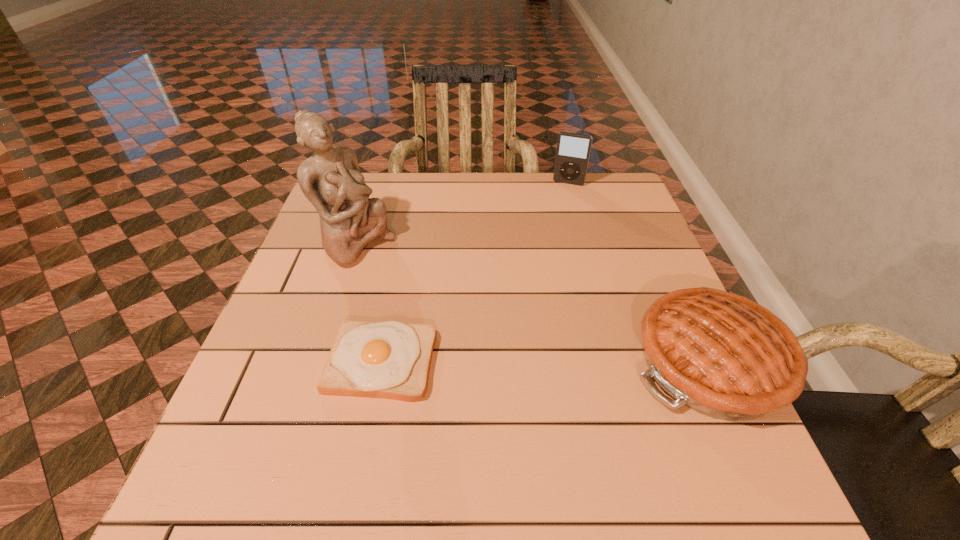
The width and height of the screenshot is (960, 540). Find the location of `free space between the tallest object and the second shortest object`. free space between the tallest object and the second shortest object is located at coordinates pyautogui.click(x=534, y=303).

Locate which object is the third closest to the toast. Please provide its 2D coordinates. Your answer should be formatted as a tuple, i.e. [(x, y)], where the tuple contains the x and y coordinates of a point satisfying the conditions above.

[(573, 150)]

Identify which object is the third nearest to the farthest object. Please provide its 2D coordinates. Your answer should be formatted as a tuple, i.e. [(x, y)], where the tuple contains the x and y coordinates of a point satisfying the conditions above.

[(391, 359)]

Identify the location of blank area in the image that satisfies the following two spatial constraints: 1. on the front side of the pie; 2. on the left side of the third shortest object. (618, 362).

Find the location of `free space that satisfies the following two spatial constraints: 1. on the front side of the second shortest object; 2. on the right side of the second tallest object`. free space that satisfies the following two spatial constraints: 1. on the front side of the second shortest object; 2. on the right side of the second tallest object is located at coordinates (618, 362).

The height and width of the screenshot is (540, 960). I want to click on free region that satisfies the following two spatial constraints: 1. on the front side of the third nearest object; 2. on the left side of the toast, so click(x=319, y=362).

Find the location of `free region that satisfies the following two spatial constraints: 1. on the back side of the shortest object; 2. on the right side of the third shortest object`. free region that satisfies the following two spatial constraints: 1. on the back side of the shortest object; 2. on the right side of the third shortest object is located at coordinates point(417,183).